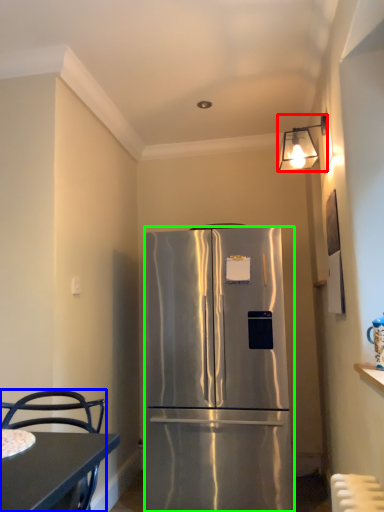
Question: Which object is positioned farthest from lamp (highlighted by a red box)? Select from chair (highlighted by a blue box) and refrigerator (highlighted by a green box).

Choices:
 (A) chair
 (B) refrigerator

Answer: (A)